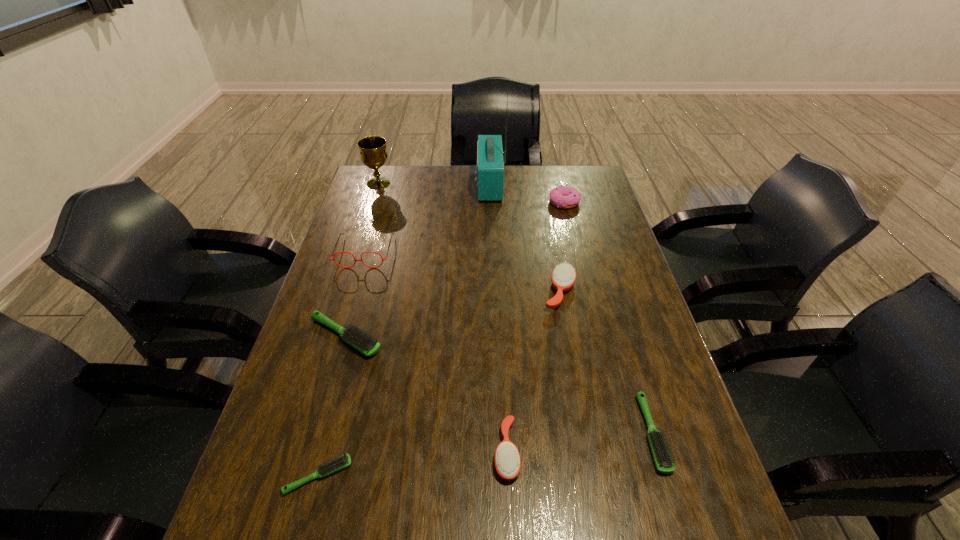
In the image, there is a desktop. Find the location of `vacant space at the far left corner`. vacant space at the far left corner is located at coordinates (404, 179).

This screenshot has height=540, width=960. I want to click on vacant space that's between the red spectacles and the shortest hairbrush, so click(342, 363).

The image size is (960, 540). What are the coordinates of `vacant space that is in between the farthest light hairbrush and the pink doughnut` in the screenshot? It's located at (455, 269).

What are the coordinates of `unoccupied position between the doughnut and the second farthest hairbrush` in the screenshot? It's located at (455, 269).

The image size is (960, 540). Find the location of `free spot between the doughnut and the shortest object`. free spot between the doughnut and the shortest object is located at coordinates (442, 339).

Locate an element on the screen. vacant space that is in between the shortest hairbrush and the red spectacles is located at coordinates click(x=342, y=363).

You are a GUI agent. You are given a task and a screenshot of the screen. Output one action in this format:
    pyautogui.click(x=<x>, y=<y>)
    Task: Click on the vacant area between the third hairbrush from left to right and the rightmost hairbrush
    The image size is (960, 540).
    Given the screenshot: What is the action you would take?
    click(579, 442)

The image size is (960, 540). Find the location of `free space between the pink doughnut and the second biggest light hairbrush`. free space between the pink doughnut and the second biggest light hairbrush is located at coordinates (608, 318).

Where is `free area in between the smaller orange hairbrush and the tallest hairbrush`? This screenshot has height=540, width=960. free area in between the smaller orange hairbrush and the tallest hairbrush is located at coordinates (533, 371).

This screenshot has height=540, width=960. I want to click on free space between the shortest hairbrush and the second farthest hairbrush, so click(x=332, y=406).